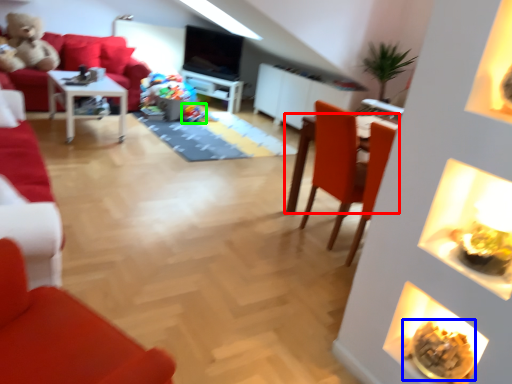
Question: Estimate the real-world distances between objects in this image. Which object is farther from table (highlighted by a red box), food (highlighted by a blue box) or food (highlighted by a green box)?

Choices:
 (A) food
 (B) food

Answer: (B)